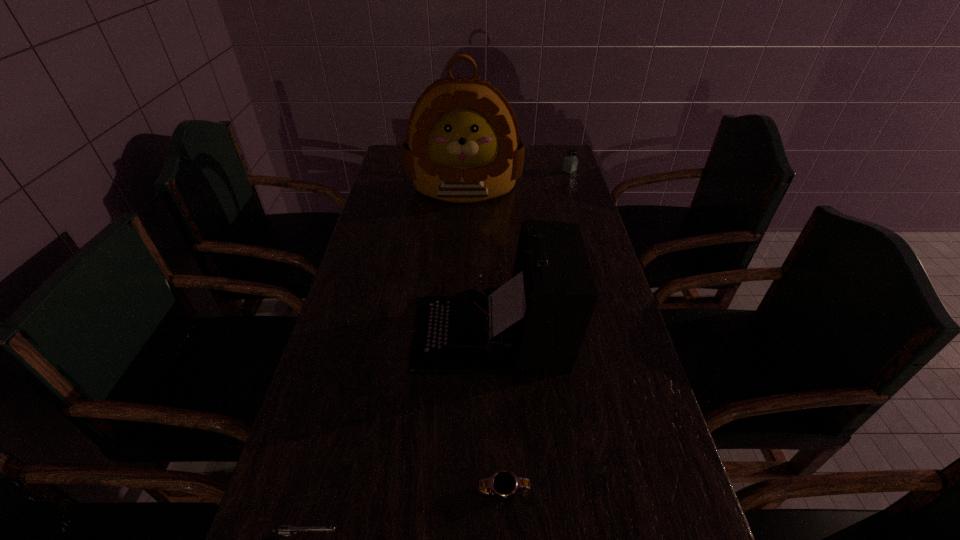
This screenshot has height=540, width=960. In order to click on backpack in this screenshot , I will do click(x=462, y=145).

I want to click on the second tallest object, so click(537, 321).

Find the location of `typewriter`. typewriter is located at coordinates (537, 321).

Identify the location of the rightmost object. The height and width of the screenshot is (540, 960). (570, 162).

You are a GUI agent. You are given a task and a screenshot of the screen. Output one action in this format:
    pyautogui.click(x=<x>, y=<y>)
    Task: Click on the saltshaker
    This screenshot has height=540, width=960.
    Given the screenshot: What is the action you would take?
    [570, 162]

Locate an element on the screen. The width and height of the screenshot is (960, 540). watch is located at coordinates (504, 483).

The height and width of the screenshot is (540, 960). In order to click on the shortest object in this screenshot , I will do `click(504, 483)`.

Locate an element on the screen. free space located on the front-facing side of the backpack is located at coordinates (462, 246).

The width and height of the screenshot is (960, 540). What are the coordinates of `free point located 0.140m inside the open case of the second tallest object` in the screenshot? It's located at (355, 333).

The width and height of the screenshot is (960, 540). What are the coordinates of `blank area located 0.160m inside the open case of the second tallest object` in the screenshot? It's located at (348, 333).